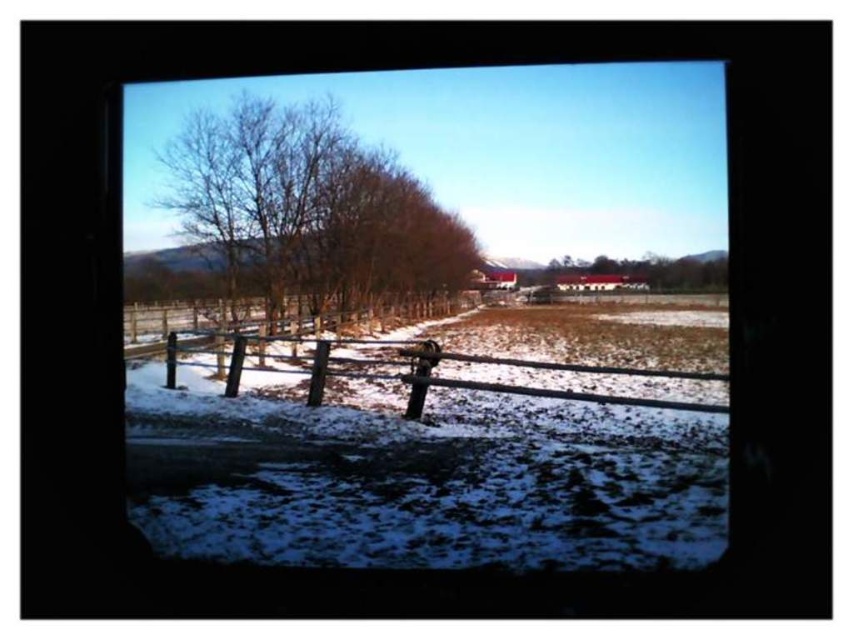
Question: Which point appears closest to the camera in this image?

Choices:
 (A) (607, 268)
 (B) (680, 141)

Answer: (B)

Question: Is brown leafless tree at center thinner than wooden fence at center?

Choices:
 (A) yes
 (B) no

Answer: (A)

Question: Can you confirm if wooden fence at center is wider than brown wood tree at center?

Choices:
 (A) no
 (B) yes

Answer: (B)

Question: Which point is closer to the camera?

Choices:
 (A) (195, 138)
 (B) (498, 365)
 (C) (642, 276)

Answer: (B)

Question: Which point is farther to the camera?

Choices:
 (A) (x=308, y=362)
 (B) (x=271, y=259)
 (C) (x=328, y=516)

Answer: (B)

Question: Can you confirm if brown leafless tree at center is wider than wooden fence at center?

Choices:
 (A) yes
 (B) no

Answer: (B)